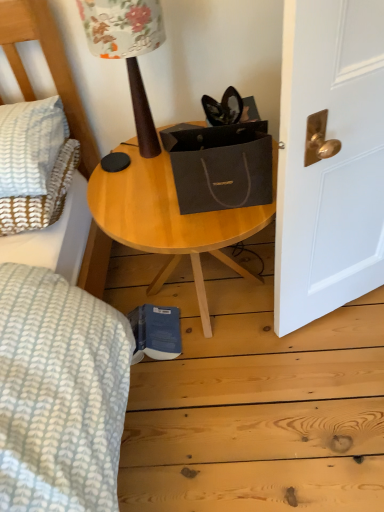
Question: From a real-world perspective, is wooden table lamp at upper center over white textured pillow at left?

Choices:
 (A) no
 (B) yes

Answer: (B)

Question: Is wooden table lamp at upper center located outside white textured pillow at left?

Choices:
 (A) no
 (B) yes

Answer: (B)

Question: Is the surface of wooden table lamp at upper center in direct contact with white textured pillow at left?

Choices:
 (A) yes
 (B) no

Answer: (B)

Question: Is wooden table lamp at upper center far away from white textured pillow at left?

Choices:
 (A) yes
 (B) no

Answer: (B)

Question: From the image's perspective, is wooden table lamp at upper center beneath white textured pillow at left?

Choices:
 (A) no
 (B) yes

Answer: (A)

Question: Considering the relative sizes of wooden table lamp at upper center and white textured pillow at left in the image provided, is wooden table lamp at upper center smaller than white textured pillow at left?

Choices:
 (A) no
 (B) yes

Answer: (A)

Question: Does white textured pillow at left contain wooden table at center?

Choices:
 (A) no
 (B) yes

Answer: (A)

Question: From a real-world perspective, is white textured pillow at left positioned under wooden table at center based on gravity?

Choices:
 (A) yes
 (B) no

Answer: (B)

Question: Does white textured pillow at left have a smaller size compared to wooden table at center?

Choices:
 (A) yes
 (B) no

Answer: (A)

Question: Is white textured pillow at left located outside wooden table at center?

Choices:
 (A) no
 (B) yes

Answer: (B)

Question: From a real-world perspective, is white textured pillow at left on wooden table at center?

Choices:
 (A) yes
 (B) no

Answer: (A)

Question: Can you confirm if white textured pillow at left is bigger than wooden table at center?

Choices:
 (A) yes
 (B) no

Answer: (B)

Question: Is wooden table lamp at upper center facing towards wooden table at center?

Choices:
 (A) no
 (B) yes

Answer: (A)